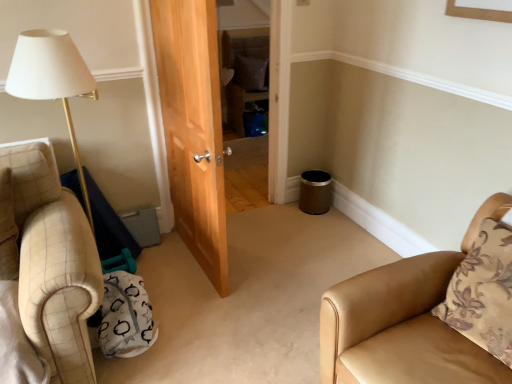
Question: Is tan leather chair at lower right closer to camera compared to brown fabric pillow at center, which is the 1th pillow in top-to-bottom order?

Choices:
 (A) yes
 (B) no

Answer: (A)

Question: Is tan leather chair at lower right wider than brown fabric pillow at center, which is the 1th pillow in top-to-bottom order?

Choices:
 (A) yes
 (B) no

Answer: (A)

Question: Is tan leather chair at lower right bigger than brown fabric pillow at center, which is the second pillow from right to left?

Choices:
 (A) yes
 (B) no

Answer: (A)

Question: Can brown fabric pillow at center, which is the second pillow from right to left, be found inside tan leather chair at lower right?

Choices:
 (A) yes
 (B) no

Answer: (B)

Question: From a real-world perspective, does tan leather chair at lower right sit lower than brown fabric pillow at center, acting as the second pillow starting from the bottom?

Choices:
 (A) yes
 (B) no

Answer: (A)

Question: Is tan leather chair at lower right taller or shorter than brown fabric pillow at center, the first pillow viewed from the back?

Choices:
 (A) short
 (B) tall

Answer: (B)

Question: Considering their positions, is tan leather chair at lower right located in front of or behind brown fabric pillow at center, which is the second pillow from right to left?

Choices:
 (A) behind
 (B) front

Answer: (B)

Question: Is tan leather chair at lower right inside or outside of brown fabric pillow at center, which is the second pillow from right to left?

Choices:
 (A) outside
 (B) inside

Answer: (A)

Question: Considering the relative positions of tan leather chair at lower right and brown fabric pillow at center, the first pillow viewed from the back, in the image provided, is tan leather chair at lower right to the left or to the right of brown fabric pillow at center, the first pillow viewed from the back,?

Choices:
 (A) right
 (B) left

Answer: (A)

Question: In the image, is brown floral pillow at right, the 2th pillow in the back-to-front sequence, positioned in front of or behind brown fabric pillow at center, the first pillow viewed from the back?

Choices:
 (A) behind
 (B) front

Answer: (B)

Question: Is brown floral pillow at right, positioned as the 1th pillow in right-to-left order, to the left or to the right of brown fabric pillow at center, the first pillow viewed from the back, in the image?

Choices:
 (A) right
 (B) left

Answer: (A)

Question: Is brown floral pillow at right, the 2th pillow in the back-to-front sequence, inside or outside of brown fabric pillow at center, which is the 1th pillow in top-to-bottom order?

Choices:
 (A) inside
 (B) outside

Answer: (B)

Question: From the image's perspective, relative to brown fabric pillow at center, which appears as the 1th pillow when viewed from the left, is brown floral pillow at right, positioned as the 1th pillow in right-to-left order, above or below?

Choices:
 (A) below
 (B) above

Answer: (A)

Question: In terms of height, does brown fabric pillow at center, acting as the second pillow starting from the bottom, look taller or shorter compared to brown floral pillow at right, which is the 1th pillow from front to back?

Choices:
 (A) short
 (B) tall

Answer: (A)

Question: From a real-world perspective, is brown fabric pillow at center, which appears as the 1th pillow when viewed from the left, above or below brown floral pillow at right, the 2th pillow in the back-to-front sequence?

Choices:
 (A) below
 (B) above

Answer: (A)